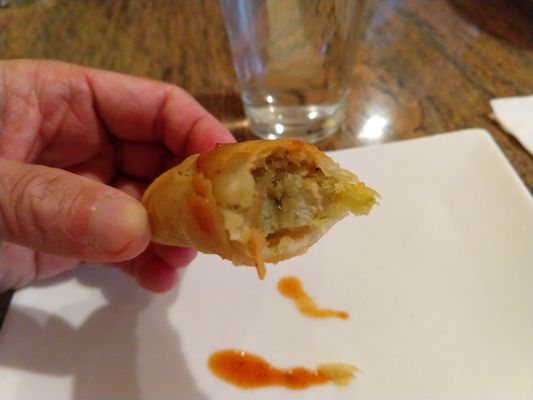
Locate an element on the screen. This screenshot has height=400, width=533. napkin is located at coordinates (511, 113).